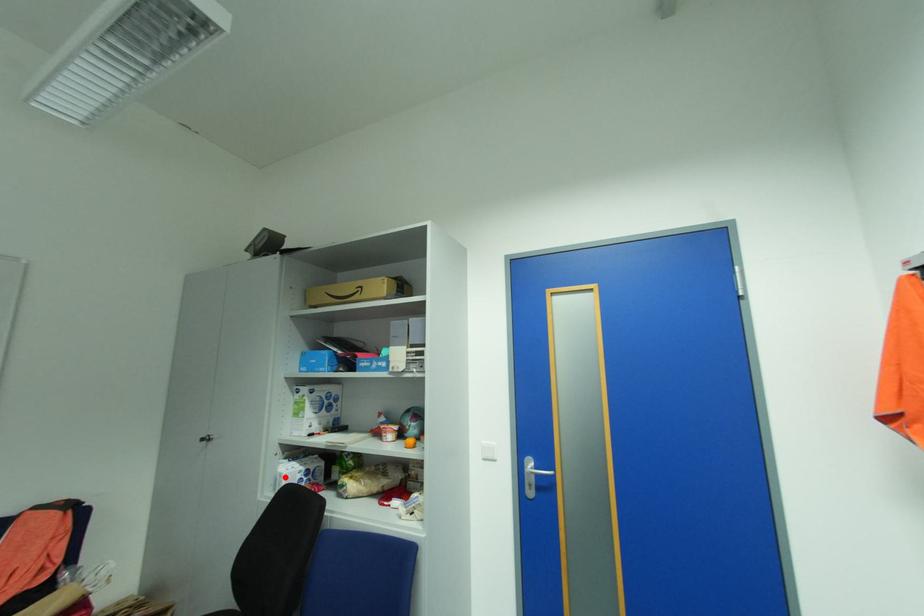
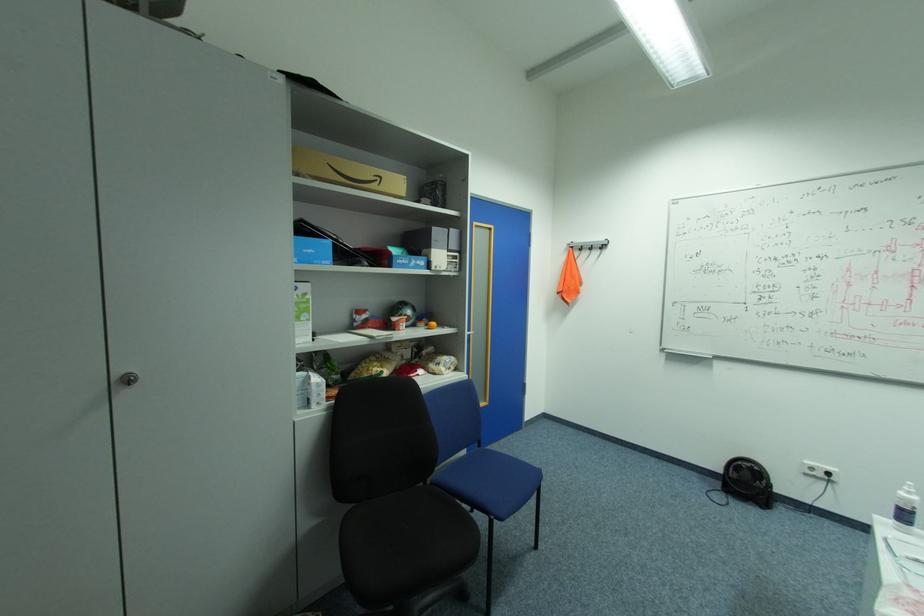
Question: I am providing you with two images of the same scene from different viewpoints. A red point is marked on the first image. At the location where the point appears in image 1, is it still visible in image 2?

Choices:
 (A) Yes
 (B) No

Answer: (A)